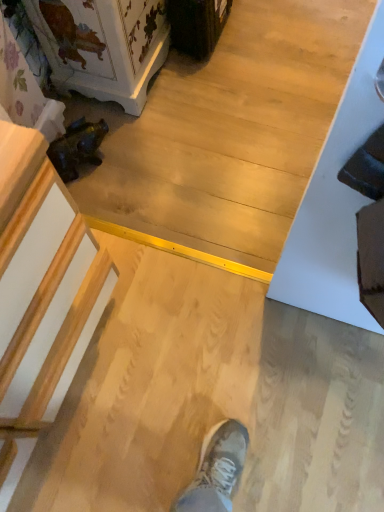
You are a GUI agent. You are given a task and a screenshot of the screen. Output one action in this format:
    pyautogui.click(x=<x>, y=<y>)
    Task: Click on the wooden carved chest at lower left
    This screenshot has height=512, width=384.
    Given the screenshot: What is the action you would take?
    pyautogui.click(x=46, y=301)

What do you see at coordinates (46, 301) in the screenshot?
I see `wooden carved chest at lower left` at bounding box center [46, 301].

In order to face wooden carved chest at lower left, should I rotate leftwards or rightwards?

A 27.032 degree turn to the left will do.

You are a GUI agent. You are given a task and a screenshot of the screen. Output one action in this format:
    pyautogui.click(x=<x>, y=<y>)
    Task: Click on the wooden carved chest at lower left
    This screenshot has height=512, width=384.
    Given the screenshot: What is the action you would take?
    pyautogui.click(x=46, y=301)